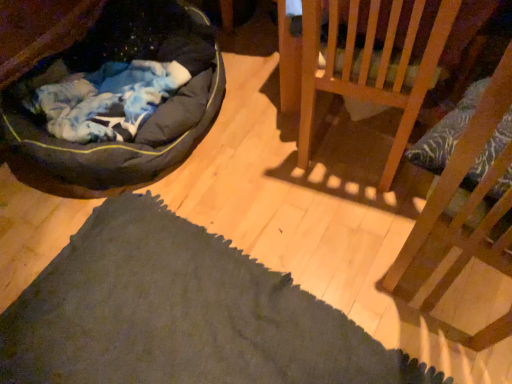
Measure the distance between point (382, 35) and camera.

They are 37.72 inches apart.

What is the approximate height of wooden chair at right, marked as the second furniture in a back-to-front arrangement?

It is 93.25 centimeters.

Identify the location of wooden chair at right, marked as the second furniture in a back-to-front arrangement. This screenshot has width=512, height=384. (461, 209).

You are a GUI agent. You are given a task and a screenshot of the screen. Output one action in this format:
    pyautogui.click(x=<x>, y=<y>)
    Task: Click on the wooden chair at upper right, which is the 2th furniture in front-to-back order
    The height and width of the screenshot is (384, 512).
    Given the screenshot: What is the action you would take?
    pyautogui.click(x=372, y=56)

I want to click on furniture below the wooden chair at upper right, which is the 2th furniture in front-to-back order (from the image's perspective), so click(461, 209).

Is wooden chair at right, marked as the second furniture in a back-to-front arrangement, placed right next to wooden chair at upper right, which is the 2th furniture in front-to-back order?

No, wooden chair at right, marked as the second furniture in a back-to-front arrangement, is not touching wooden chair at upper right, which is the 2th furniture in front-to-back order.

Between wooden chair at right, acting as the 1th furniture starting from the front, and wooden chair at upper right, which is the 2th furniture in front-to-back order, which one has larger size?

wooden chair at right, acting as the 1th furniture starting from the front.

Looking at this image, is wooden chair at right, acting as the 1th furniture starting from the front, oriented away from wooden chair at upper right, arranged as the first furniture when viewed from the back?

No.

From a real-world perspective, who is located higher, dark gray fabric dog bed at left or wooden chair at upper right, arranged as the first furniture when viewed from the back?

In real-world perspective, dark gray fabric dog bed at left is above.

Which of these two, dark gray fabric dog bed at left or wooden chair at upper right, arranged as the first furniture when viewed from the back, stands taller?

Standing taller between the two is dark gray fabric dog bed at left.

Does point (174, 44) come behind point (336, 84)?

Yes, it is.

From the image's perspective, between dark gray fabric dog bed at left and wooden chair at upper right, which is the 2th furniture in front-to-back order, which one is located above?

dark gray fabric dog bed at left appears higher in the image.

Is wooden chair at right, acting as the 1th furniture starting from the front, looking in the opposite direction of dark gray fabric dog bed at left?

That's not correct — wooden chair at right, acting as the 1th furniture starting from the front, is not looking away from dark gray fabric dog bed at left.

Which object is further away from the camera taking this photo, wooden chair at right, acting as the 1th furniture starting from the front, or dark gray fabric dog bed at left?

dark gray fabric dog bed at left is further from the camera.

Based on the photo, what's the angular difference between wooden chair at right, acting as the 1th furniture starting from the front, and dark gray fabric dog bed at left's facing directions?

83.1 degrees.

Between wooden chair at right, acting as the 1th furniture starting from the front, and dark gray fabric dog bed at left, which one appears on the right side from the viewer's perspective?

wooden chair at right, acting as the 1th furniture starting from the front.

Measure the distance between dark gray fabric dog bed at left and wooden chair at right, acting as the 1th furniture starting from the front.

1.02 meters.

Does point (120, 113) come farther from viewer compared to point (508, 148)?

Yes, point (120, 113) is farther from viewer.

Is dark gray fabric dog bed at left beside wooden chair at right, acting as the 1th furniture starting from the front?

No, dark gray fabric dog bed at left is not touching wooden chair at right, acting as the 1th furniture starting from the front.

Between dark gray fabric dog bed at left and wooden chair at right, marked as the second furniture in a back-to-front arrangement, which one has smaller size?

wooden chair at right, marked as the second furniture in a back-to-front arrangement.

Does wooden chair at upper right, which is the 2th furniture in front-to-back order, have a greater width compared to dark gray fabric dog bed at left?

In fact, wooden chair at upper right, which is the 2th furniture in front-to-back order, might be narrower than dark gray fabric dog bed at left.

From a real-world perspective, is wooden chair at upper right, which is the 2th furniture in front-to-back order, located higher than dark gray fabric dog bed at left?

No, from a real-world perspective, wooden chair at upper right, which is the 2th furniture in front-to-back order, is not above dark gray fabric dog bed at left.

Looking at this image, considering their positions, is wooden chair at upper right, arranged as the first furniture when viewed from the back, located in front of or behind dark gray fabric dog bed at left?

In the image, wooden chair at upper right, arranged as the first furniture when viewed from the back, appears behind dark gray fabric dog bed at left.

I want to click on furniture behind the dark gray fabric dog bed at left, so click(x=372, y=56).

Is wooden chair at right, acting as the 1th furniture starting from the front, at the back of wooden chair at upper right, which is the 2th furniture in front-to-back order?

No, wooden chair at upper right, which is the 2th furniture in front-to-back order, is not facing away from wooden chair at right, acting as the 1th furniture starting from the front.

Consider the image. Is wooden chair at upper right, arranged as the first furniture when viewed from the back, wider than wooden chair at right, acting as the 1th furniture starting from the front?

In fact, wooden chair at upper right, arranged as the first furniture when viewed from the back, might be narrower than wooden chair at right, acting as the 1th furniture starting from the front.

What's the angular difference between wooden chair at upper right, which is the 2th furniture in front-to-back order, and wooden chair at right, marked as the second furniture in a back-to-front arrangement,'s facing directions?

The facing directions of wooden chair at upper right, which is the 2th furniture in front-to-back order, and wooden chair at right, marked as the second furniture in a back-to-front arrangement, are 170 degrees apart.

Find the location of a particular element. The height and width of the screenshot is (384, 512). furniture that is above the wooden chair at right, acting as the 1th furniture starting from the front (from the image's perspective) is located at coordinates (372, 56).

You are a GUI agent. You are given a task and a screenshot of the screen. Output one action in this format:
    pyautogui.click(x=<x>, y=<y>)
    Task: Click on the furniture below the dark gray fabric dog bed at left (from a real-world perspective)
    Image resolution: width=512 pixels, height=384 pixels.
    Given the screenshot: What is the action you would take?
    pyautogui.click(x=372, y=56)

Estimate the real-world distances between objects in this image. Which object is closer to wooden chair at right, acting as the 1th furniture starting from the front, dark gray fabric dog bed at left or wooden chair at upper right, arranged as the first furniture when viewed from the back?

The object closer to wooden chair at right, acting as the 1th furniture starting from the front, is wooden chair at upper right, arranged as the first furniture when viewed from the back.

Which object lies further to the anchor point wooden chair at upper right, arranged as the first furniture when viewed from the back, dark gray fabric dog bed at left or wooden chair at right, marked as the second furniture in a back-to-front arrangement?

Among the two, dark gray fabric dog bed at left is located further to wooden chair at upper right, arranged as the first furniture when viewed from the back.

When comparing their distances from dark gray fabric dog bed at left, does wooden chair at right, acting as the 1th furniture starting from the front, or wooden chair at upper right, which is the 2th furniture in front-to-back order, seem closer?

wooden chair at upper right, which is the 2th furniture in front-to-back order, lies closer to dark gray fabric dog bed at left than the other object.

From the image, which object appears to be nearer to dark gray fabric dog bed at left, wooden chair at upper right, which is the 2th furniture in front-to-back order, or wooden chair at right, acting as the 1th furniture starting from the front?

The object closer to dark gray fabric dog bed at left is wooden chair at upper right, which is the 2th furniture in front-to-back order.

Based on their spatial positions, is wooden chair at right, acting as the 1th furniture starting from the front, or dark gray fabric dog bed at left closer to wooden chair at upper right, which is the 2th furniture in front-to-back order?

Among the two, wooden chair at right, acting as the 1th furniture starting from the front, is located nearer to wooden chair at upper right, which is the 2th furniture in front-to-back order.

Which object lies further to the anchor point wooden chair at right, acting as the 1th furniture starting from the front, wooden chair at upper right, which is the 2th furniture in front-to-back order, or dark gray fabric dog bed at left?

dark gray fabric dog bed at left.

You are a GUI agent. You are given a task and a screenshot of the screen. Output one action in this format:
    pyautogui.click(x=<x>, y=<y>)
    Task: Click on the furniture situated between dark gray fabric dog bed at left and wooden chair at right, acting as the 1th furniture starting from the front, from left to right
    The width and height of the screenshot is (512, 384).
    Given the screenshot: What is the action you would take?
    (372, 56)